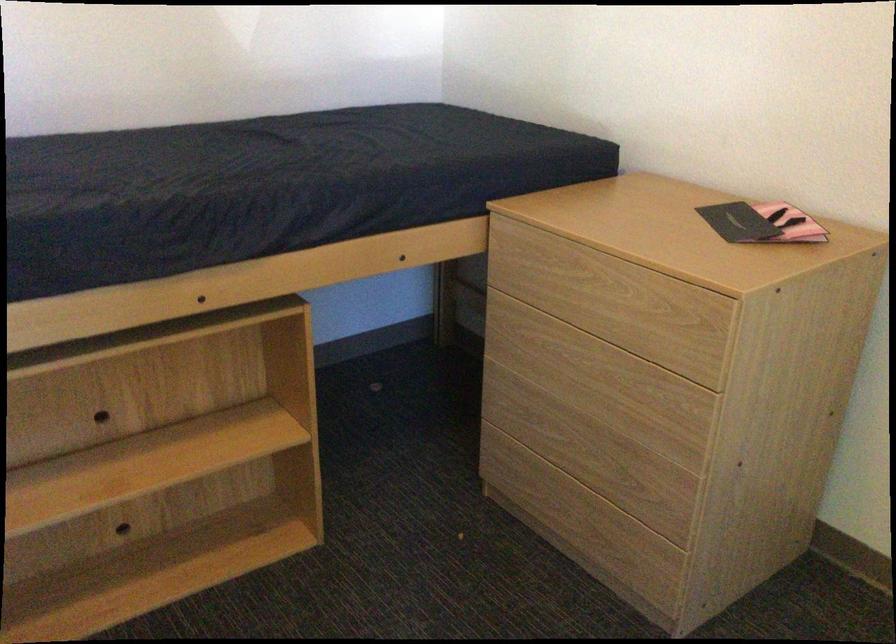
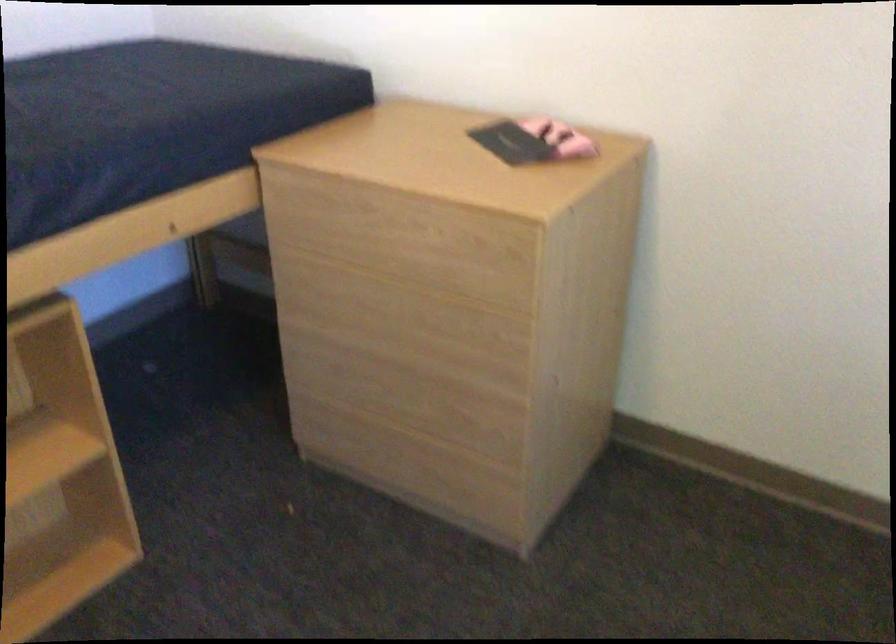
The point at (596, 384) is marked in the first image. Where is the corresponding point in the second image?

(410, 327)